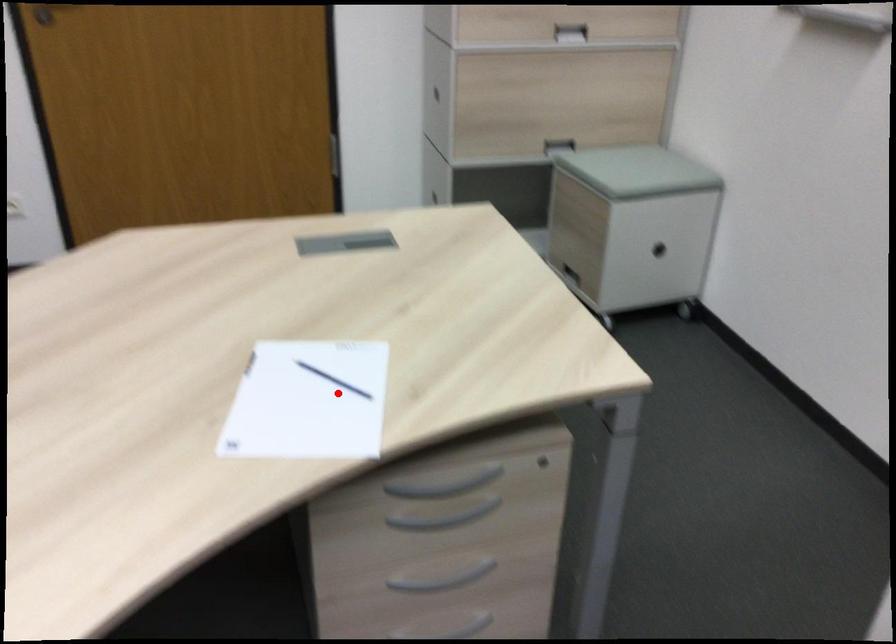
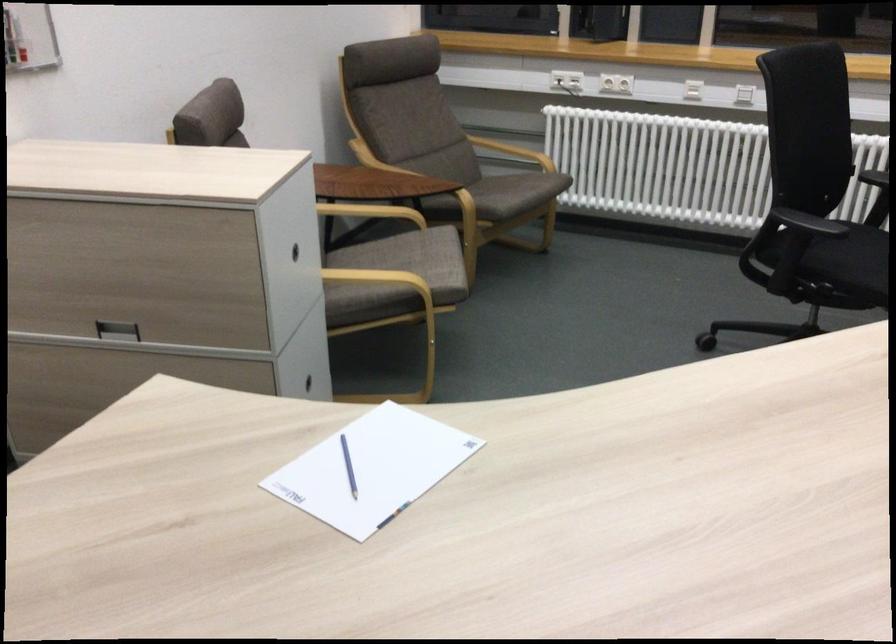
The point at the highlighted location is marked in the first image. Where is the corresponding point in the second image?

(348, 466)